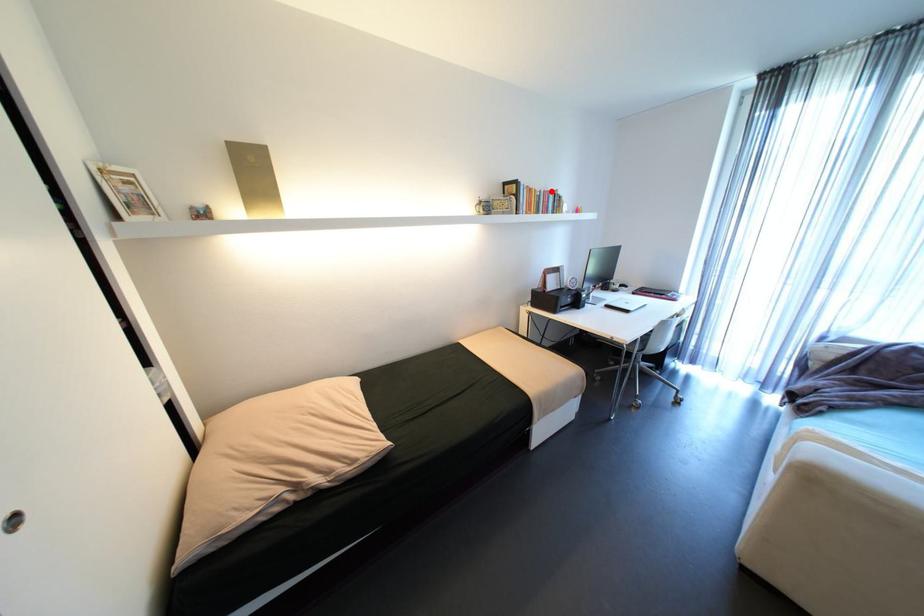
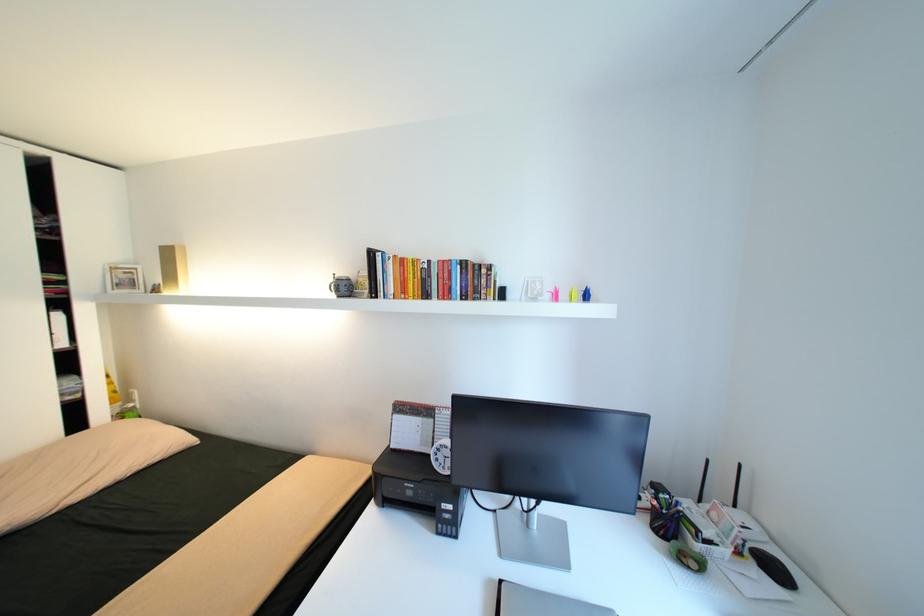
The point at the highlighted location is marked in the first image. Where is the corresponding point in the second image?

(445, 262)